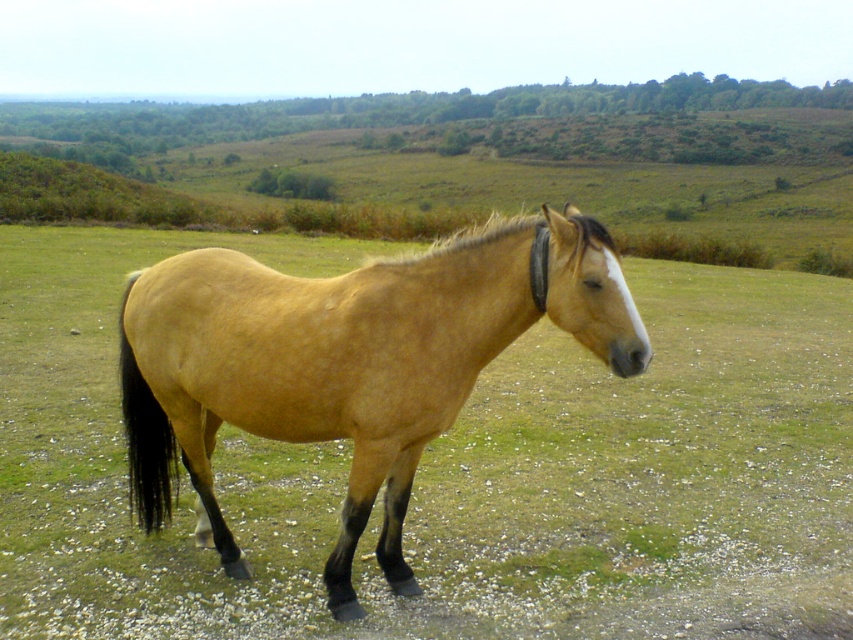
You are a photographer trying to capture the golden matte horse at center and the golden smooth mane at center in a single frame. Based on their sizes in the image, which object would require you to zoom out more to include both in the frame?

The golden smooth mane at center requires zooming out more because it is wider than the golden matte horse at center, as stated in the description.

Looking at this image, you are a painter observing the golden matte horse at center and the golden smooth mane at center. Which object is taller?

The golden smooth mane at center is taller than the golden matte horse at center.

You are a photographer standing 3 meters away from the golden matte horse at center. You want to take a photo of it. Can you get close enough to capture its face clearly without moving?

The golden matte horse at center is 2.94 meters away, so yes, you can get close enough to capture its face clearly since you are already within the 3 meters distance.